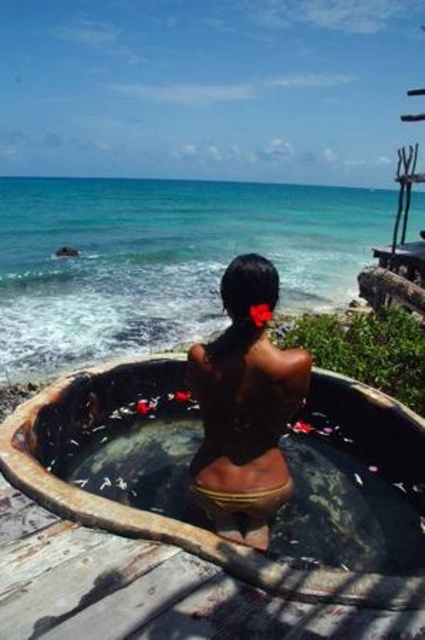
Which is in front, point (11, 320) or point (266, 353)?

Point (266, 353)

Can you confirm if smooth concrete tub at center is shorter than black matte swimsuit at center?

No, smooth concrete tub at center is not shorter than black matte swimsuit at center.

Is point (309, 205) farther from camera compared to point (223, 340)?

Yes, point (309, 205) is behind point (223, 340).

Find the location of a particular element. smooth concrete tub at center is located at coordinates (164, 259).

Is rustic stone tub at center positioned in front of black matte swimsuit at center?

Yes, it is.

Does rustic stone tub at center have a greater width compared to black matte swimsuit at center?

Correct, the width of rustic stone tub at center exceeds that of black matte swimsuit at center.

Describe the element at coordinates (198, 520) in the screenshot. I see `rustic stone tub at center` at that location.

This screenshot has height=640, width=425. I want to click on rustic stone tub at center, so tap(198, 520).

Based on the photo, which of these two, rustic stone tub at center or smooth concrete tub at center, stands taller?

With more height is smooth concrete tub at center.

Does rustic stone tub at center appear on the right side of smooth concrete tub at center?

Correct, you'll find rustic stone tub at center to the right of smooth concrete tub at center.

Which is behind, point (234, 612) or point (153, 321)?

The point (153, 321) is more distant.

The height and width of the screenshot is (640, 425). Identify the location of rustic stone tub at center. (198, 520).